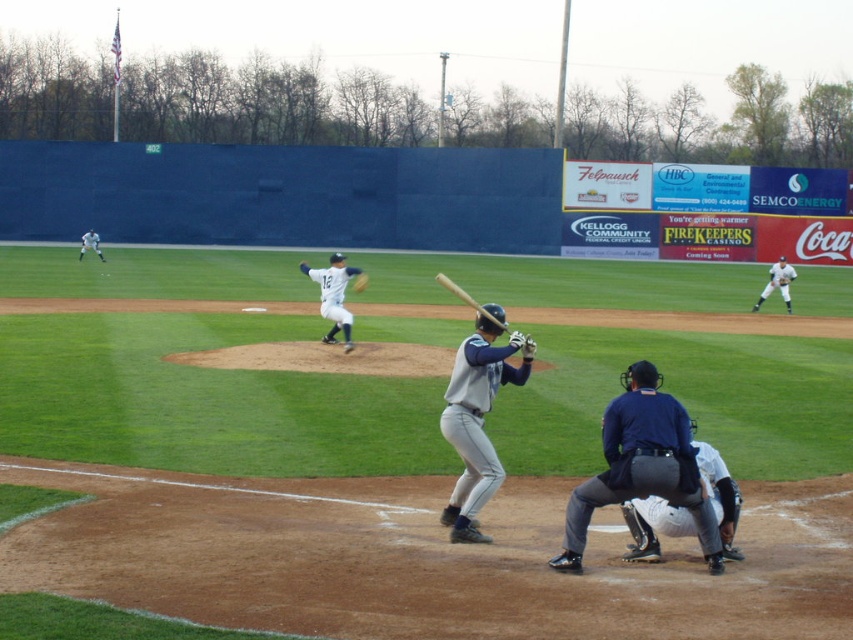
Question: Which point is farther to the camera?

Choices:
 (A) gray fabric catcher at lower center
 (B) black leather umpire at lower center

Answer: (A)

Question: Which of these objects is positioned closest to the wooden baseball bat at center?

Choices:
 (A) white matte baseball pitcher at center
 (B) white uniformed baseball player at center
 (C) gray fabric catcher at lower center
 (D) black leather umpire at lower center

Answer: (D)

Question: Which point is closer to the camera taking this photo?

Choices:
 (A) (91, 230)
 (B) (778, 268)

Answer: (B)

Question: Does gray fabric catcher at lower center appear over white matte baseball pitcher at center?

Choices:
 (A) no
 (B) yes

Answer: (A)

Question: Can you confirm if gray fabric catcher at lower center is positioned to the right of white matte baseball pitcher at center?

Choices:
 (A) yes
 (B) no

Answer: (A)

Question: Can you confirm if gray matte baseball bat at center is thinner than wooden baseball bat at center?

Choices:
 (A) yes
 (B) no

Answer: (A)